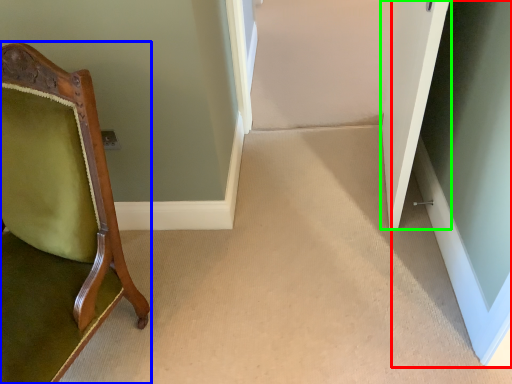
Question: Which object is positioned closest to glass door (highlighted by a red box)? Select from chair (highlighted by a blue box) and door (highlighted by a green box).

Choices:
 (A) chair
 (B) door

Answer: (B)